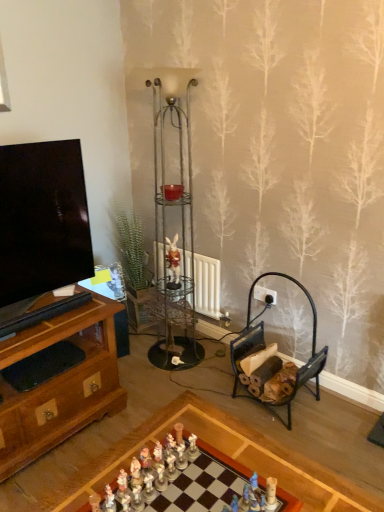
What are the coordinates of `free space in front of black metal firewood rack at lower right` in the screenshot? It's located at (314, 441).